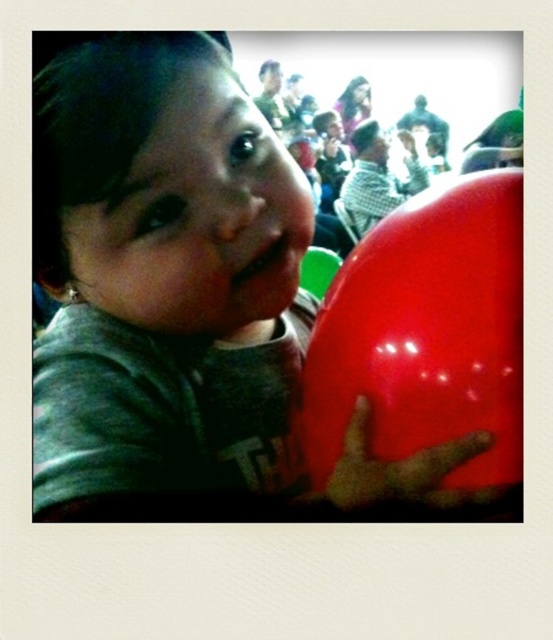
Question: Which point is farther from the camera taking this photo?

Choices:
 (A) (444, 504)
 (B) (434, 390)
 (C) (132, 67)

Answer: (B)

Question: Among these points, which one is nearest to the camera?

Choices:
 (A) (71, 97)
 (B) (476, 316)
 (C) (335, 506)

Answer: (A)

Question: Observing the image, what is the correct spatial positioning of glossy red balloon at right in reference to rubber glove at right?

Choices:
 (A) below
 (B) above

Answer: (B)

Question: Which object is farther from the camera taking this photo?

Choices:
 (A) matte plastic balloon at center
 (B) rubber glove at right
 (C) glossy red balloon at right

Answer: (C)

Question: Does glossy red balloon at right appear on the right side of rubber glove at right?

Choices:
 (A) no
 (B) yes

Answer: (B)

Question: Can you confirm if matte plastic balloon at center is smaller than glossy red balloon at right?

Choices:
 (A) yes
 (B) no

Answer: (B)